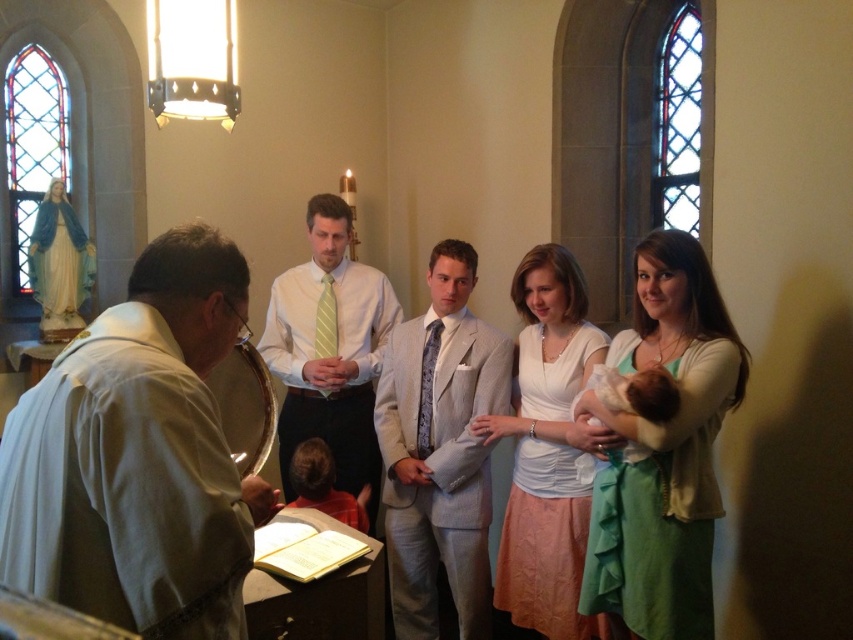
Question: Is white satin dress at center closer to the viewer compared to orange fabric shirt at lower left?

Choices:
 (A) no
 (B) yes

Answer: (B)

Question: Which of the following is the closest to the observer?

Choices:
 (A) (393, 385)
 (B) (505, 515)

Answer: (B)

Question: Which object appears farthest from the camera in this image?

Choices:
 (A) green textured dress at center
 (B) white shirt with tie at center
 (C) white satin dress at center
 (D) soft white fabric at center

Answer: (B)

Question: Which of the following is the closest to the observer?

Choices:
 (A) (648, 442)
 (B) (212, 449)
 (C) (287, 358)
 (D) (311, 448)

Answer: (B)

Question: Considering the relative positions of light gray suit at center and orange fabric shirt at lower left in the image provided, where is light gray suit at center located with respect to orange fabric shirt at lower left?

Choices:
 (A) left
 (B) right

Answer: (B)

Question: Can you confirm if white cloth at left is thinner than white satin dress at center?

Choices:
 (A) no
 (B) yes

Answer: (B)